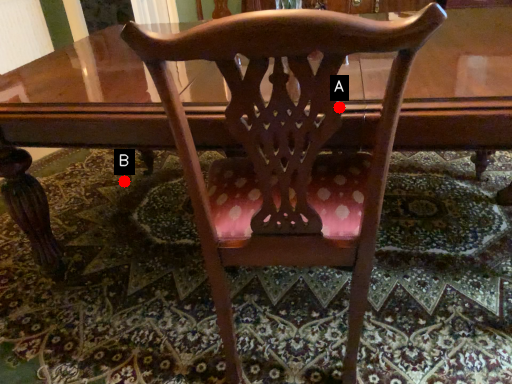
Question: Two points are circled on the image, labeled by A and B beside each circle. Which point is closer to the camera?

Choices:
 (A) A is closer
 (B) B is closer

Answer: (A)